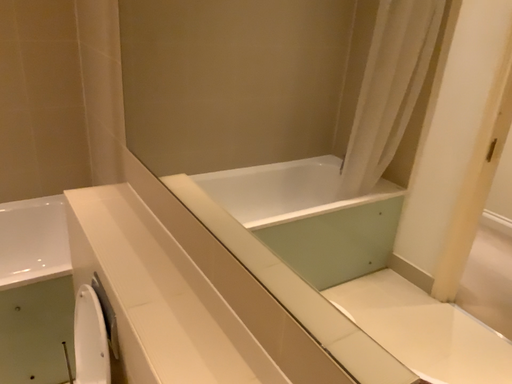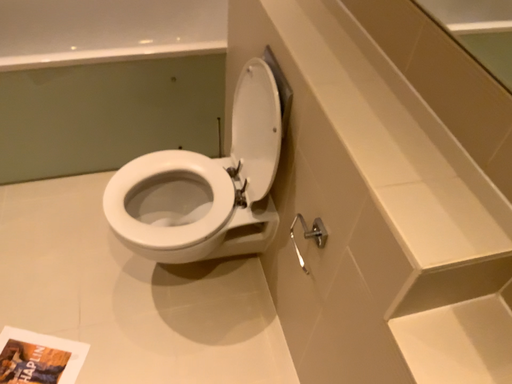
Question: Which way did the camera rotate in the video?

Choices:
 (A) rotated downward
 (B) rotated upward

Answer: (A)